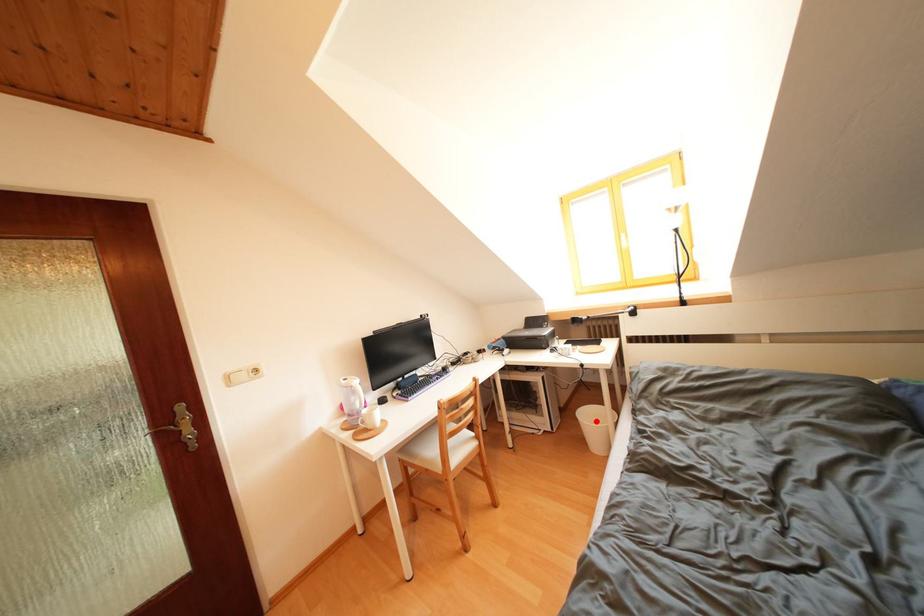
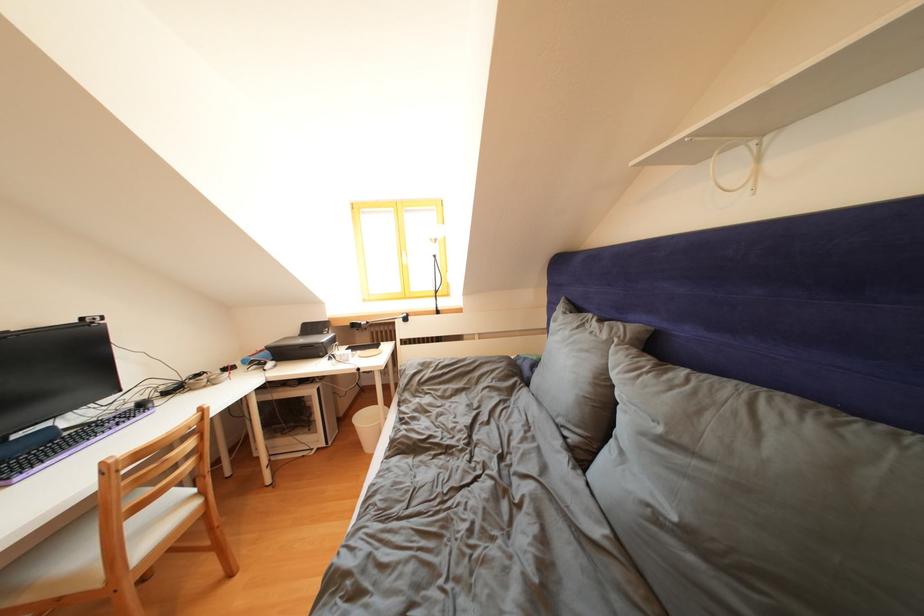
Question: A red point is marked in image1. In image2, is the corresponding 3D point closer to the camera or farther? Reply with the corresponding letter.

Choices:
 (A) The corresponding 3D point is closer.
 (B) The corresponding 3D point is farther.

Answer: (B)